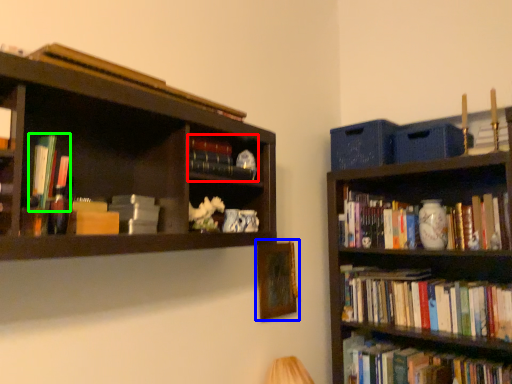
Question: Which is nearer to the book (highlighted by a red box)? picture frame (highlighted by a blue box) or book (highlighted by a green box).

Choices:
 (A) picture frame
 (B) book

Answer: (B)